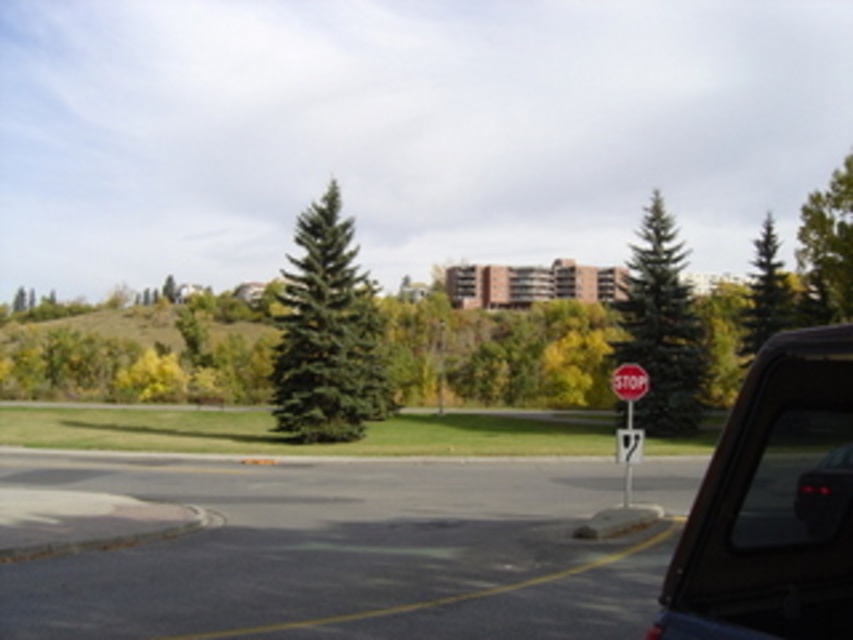
You are a delivery driver who needs to park your vehicle on the road. The road has a black glossy car at lower right and a metallic stop sign at right. Which object takes up more horizontal space in the image?

The metallic stop sign at right takes up more horizontal space than the black glossy car at lower right because the black glossy car at lower right is narrower than the metallic stop sign at right.

Based on the photo, you are driving a car and see the black glossy car at lower right and the red plastic stop sign at center right. Which object is closer to you?

The black glossy car at lower right is closer to you because it is in front of the red plastic stop sign at center right.

You are a delivery driver who needs to park your vehicle on the right side of the road. The parking space is only wide enough for vehicles narrower than the green matte tree at upper right. Can your matte black car at right fit into the space?

The matte black car at right has a lesser width compared to the green matte tree at upper right, so yes, the matte black car at right can fit into the parking space.